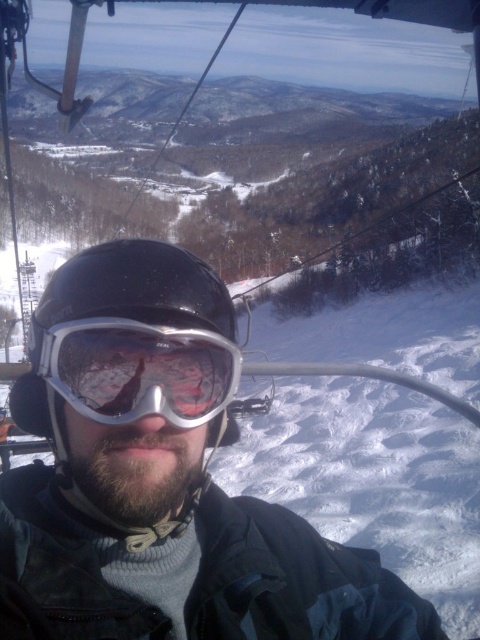
Can you confirm if matte black helmet at center is shorter than black matte helmet at center?

Incorrect, matte black helmet at center's height does not fall short of black matte helmet at center's.

Consider the image. Does matte black helmet at center have a greater width compared to black matte helmet at center?

Indeed, matte black helmet at center has a greater width compared to black matte helmet at center.

Describe the element at coordinates (160, 480) in the screenshot. The image size is (480, 640). I see `matte black helmet at center` at that location.

Where is `matte black helmet at center`? This screenshot has height=640, width=480. matte black helmet at center is located at coordinates (160, 480).

The width and height of the screenshot is (480, 640). Describe the element at coordinates (160, 480) in the screenshot. I see `matte black helmet at center` at that location.

Identify the location of matte black helmet at center. (160, 480).

Describe the element at coordinates (130, 388) in the screenshot. This screenshot has width=480, height=640. I see `black matte helmet at center` at that location.

I want to click on black matte helmet at center, so click(130, 388).

Locate an element on the screen. This screenshot has height=640, width=480. black matte helmet at center is located at coordinates (130, 388).